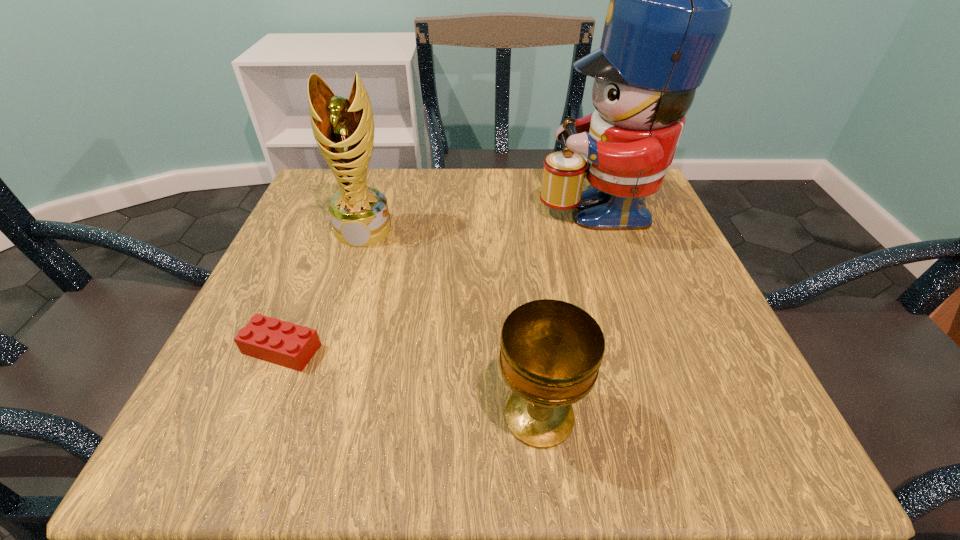
Locate an element on the screen. Image resolution: width=960 pixels, height=540 pixels. free space located 0.320m on the back of the chalice is located at coordinates (520, 242).

The image size is (960, 540). Find the location of `free spot located on the back of the Lego`. free spot located on the back of the Lego is located at coordinates [x=322, y=253].

Identify the location of nutcracker that is at the far edge. (669, 9).

At what (x,y) coordinates should I click in order to perform the action: click on award at the far edge. Please return your answer as a coordinate pair (x, y). Looking at the image, I should click on (343, 128).

Where is `object at the near edge`? The height and width of the screenshot is (540, 960). object at the near edge is located at coordinates (551, 351).

At what (x,y) coordinates should I click in order to perform the action: click on award that is at the left edge. Please return your answer as a coordinate pair (x, y). Looking at the image, I should click on (343, 128).

Locate an element on the screen. This screenshot has height=540, width=960. Lego that is positioned at the left edge is located at coordinates (283, 343).

Locate an element on the screen. This screenshot has height=540, width=960. object positioned at the right edge is located at coordinates (669, 9).

This screenshot has width=960, height=540. Identify the location of object located at the far left corner. (343, 128).

I want to click on object that is at the far right corner, so click(x=669, y=9).